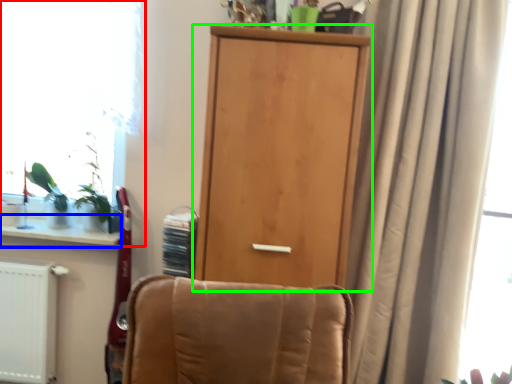
Question: Which object is the closest to the window (highlighted by a red box)? Choose among these: window sill (highlighted by a blue box) or door (highlighted by a green box).

Choices:
 (A) window sill
 (B) door

Answer: (A)